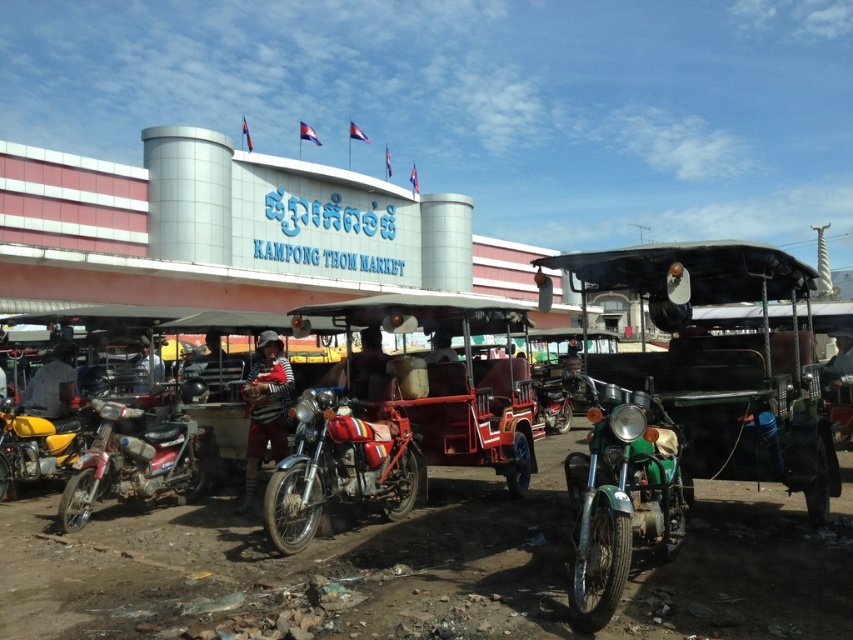
You are standing at the entrance of Kampong Thom Market and want to find the green matte motorcycle at lower right. According to the coordinates provided, where exactly is it positioned?

The green matte motorcycle at lower right is located at point (619,497), which means it is positioned towards the lower right area of the image based on the coordinate system provided.